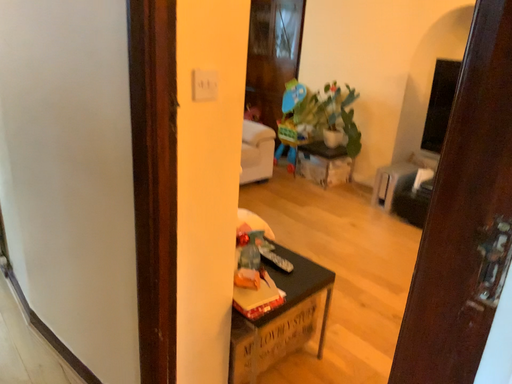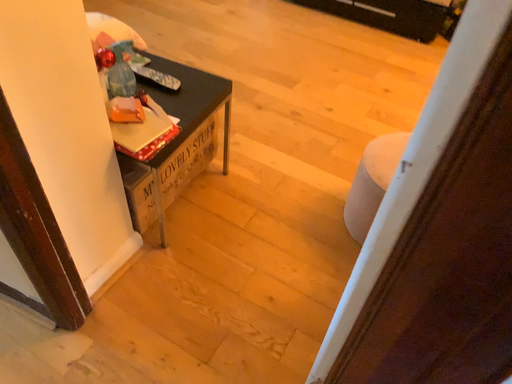
Question: How did the camera likely rotate when shooting the video?

Choices:
 (A) rotated downward
 (B) rotated upward

Answer: (A)